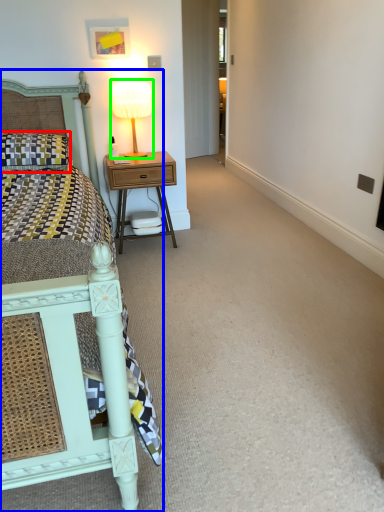
Question: Which object is the farthest from pillow (highlighted by a red box)? Choose among these: bed (highlighted by a blue box) or bedside lamp (highlighted by a green box).

Choices:
 (A) bed
 (B) bedside lamp

Answer: (A)